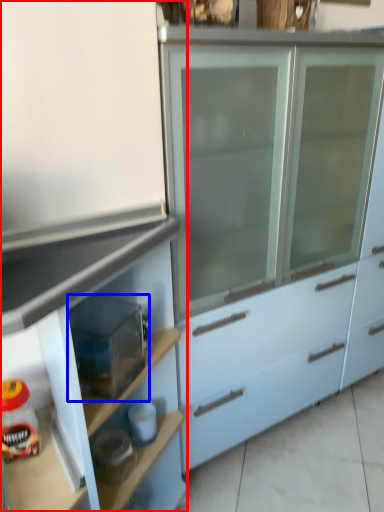
Question: Which point is closer to the camera, cabinetry (highlighted by a red box) or appliance (highlighted by a blue box)?

Choices:
 (A) cabinetry
 (B) appliance

Answer: (A)